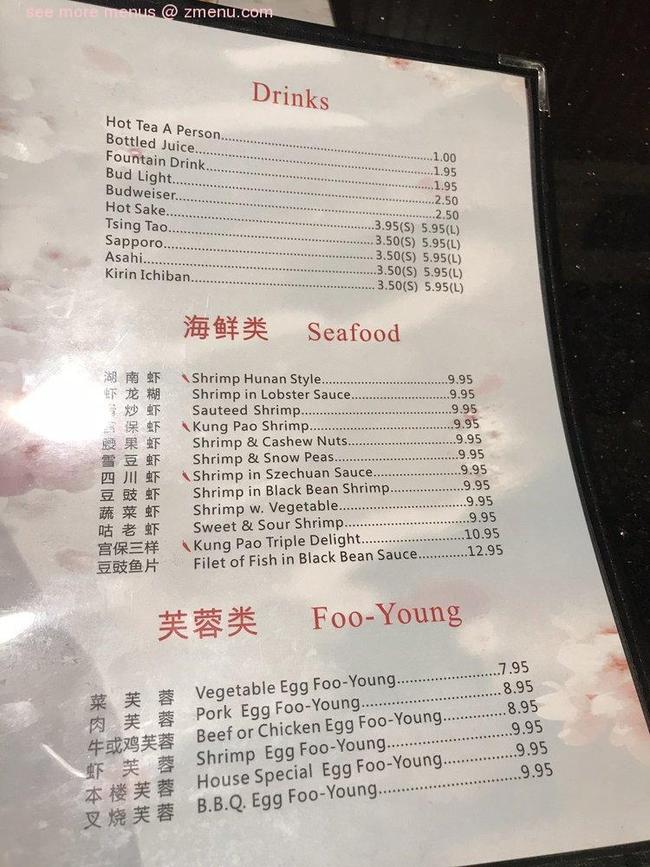
The height and width of the screenshot is (867, 650). Find the location of `light reflection on menu`. light reflection on menu is located at coordinates (65, 416).